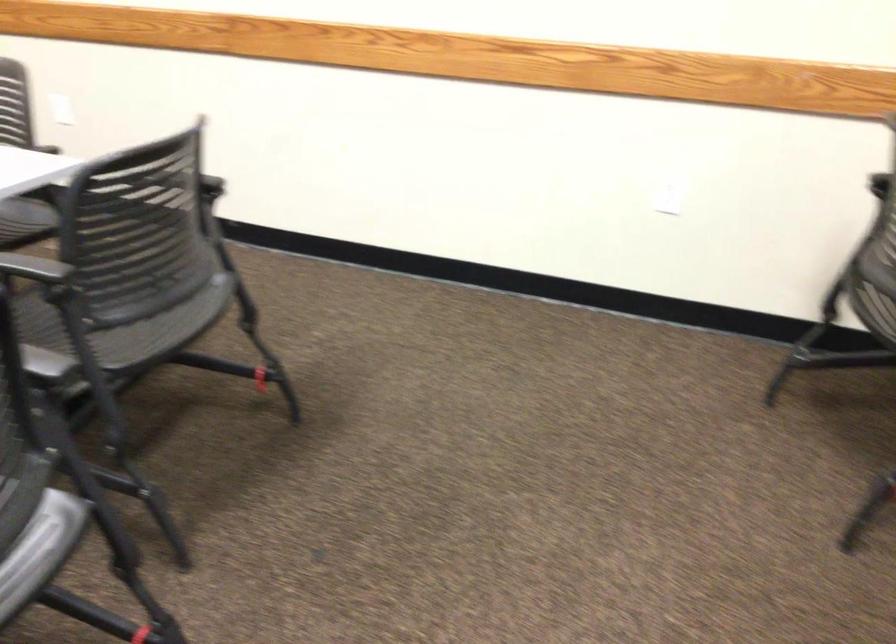
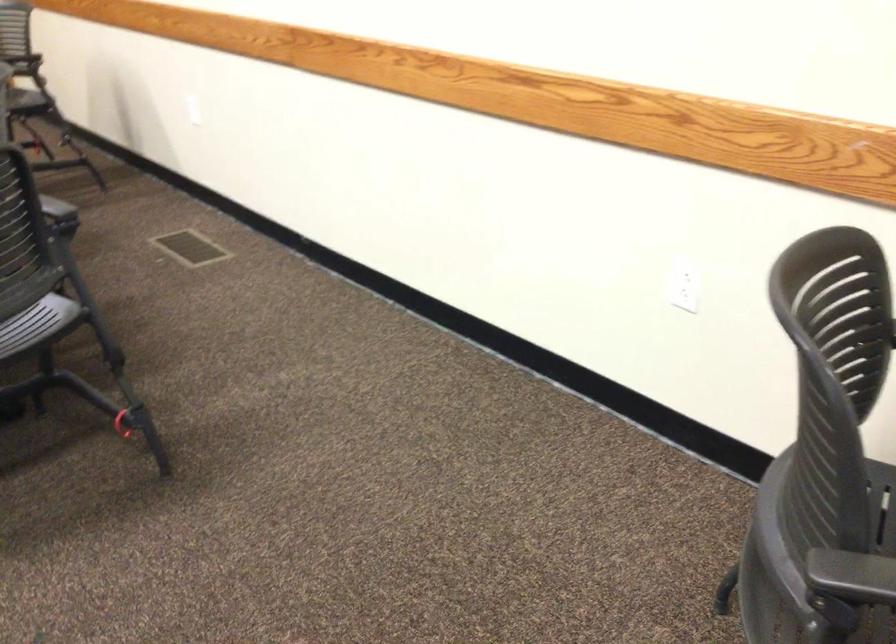
In the second image, find the point that corresponds to (x=179, y=301) in the first image.

(37, 323)